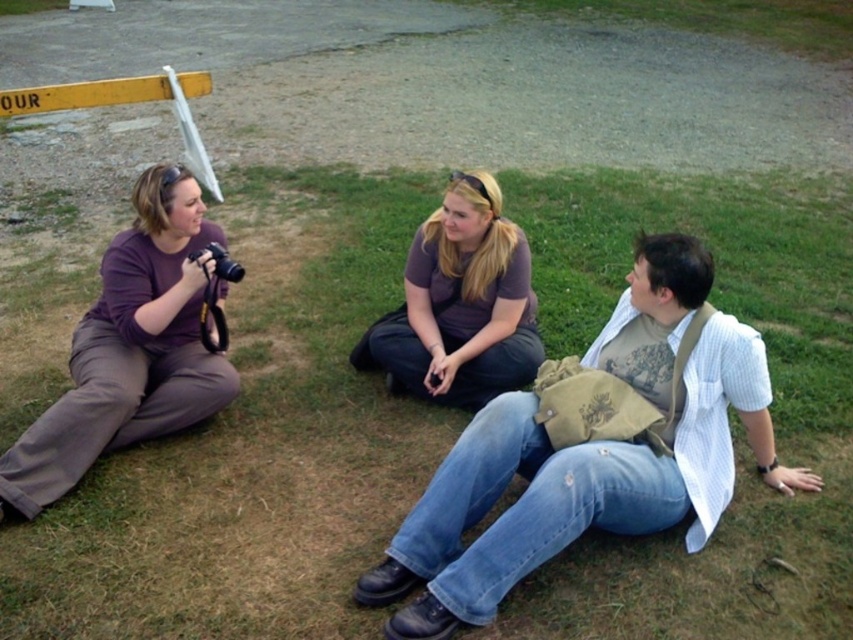
Between green grass at center and black plastic camera at left, which one is positioned higher?

black plastic camera at left is above.

Is point (608, 582) farther from camera compared to point (224, 275)?

No, it is in front of (224, 275).

Where is `green grass at center`? This screenshot has height=640, width=853. green grass at center is located at coordinates (254, 444).

Between purple cotton shirt at center and yellow painted metal sign at upper left, which one is positioned higher?

yellow painted metal sign at upper left is above.

Who is more forward, (473, 339) or (135, 93)?

Positioned in front is point (473, 339).

Between point (422, 276) and point (196, 144), which one is positioned behind?

Point (196, 144)

Find the location of a particular element. The image size is (853, 640). purple cotton shirt at center is located at coordinates (463, 304).

Does green grass at center appear over purple cotton shirt at center?

Actually, green grass at center is below purple cotton shirt at center.

Is point (368, 305) less distant than point (460, 276)?

No, it is not.

Where is `green grass at center`? The image size is (853, 640). green grass at center is located at coordinates (254, 444).

Locate an element on the screen. green grass at center is located at coordinates (254, 444).